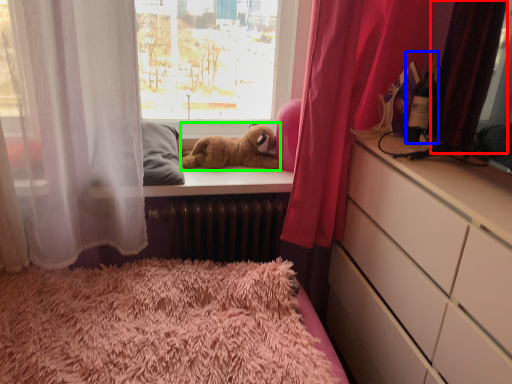
Question: Which object is the farthest from curtain (highlighted by a red box)? Choose among these: bottle (highlighted by a blue box) or animal (highlighted by a green box).

Choices:
 (A) bottle
 (B) animal

Answer: (B)